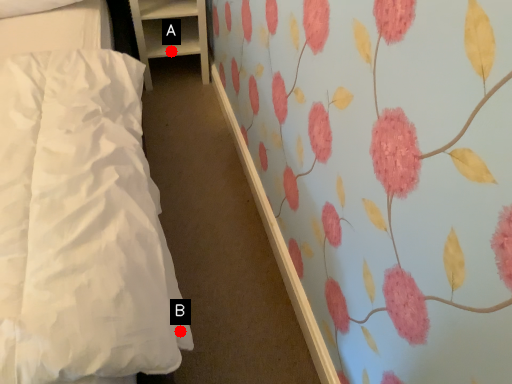
Question: Two points are circled on the image, labeled by A and B beside each circle. Which point is closer to the camera taking this photo?

Choices:
 (A) A is closer
 (B) B is closer

Answer: (B)